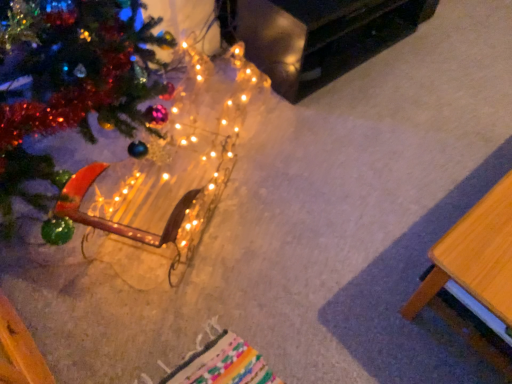
I want to click on free space to the left of wooden table at lower right, arranged as the 2th table when viewed from the top, so click(x=335, y=248).